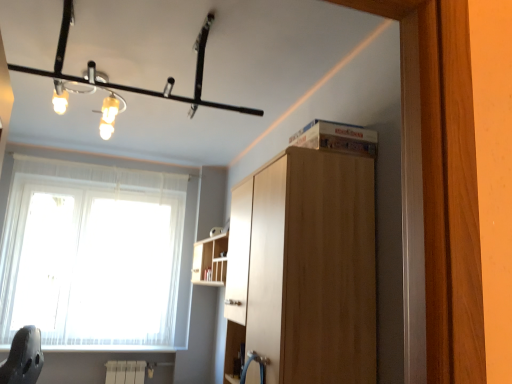
Question: Is matte black light fixture at upper center closer to camera compared to wooden shelf at upper center?

Choices:
 (A) yes
 (B) no

Answer: (A)

Question: Does matte black light fixture at upper center appear on the right side of wooden shelf at upper center?

Choices:
 (A) yes
 (B) no

Answer: (B)

Question: From a real-world perspective, is matte black light fixture at upper center on top of wooden shelf at upper center?

Choices:
 (A) yes
 (B) no

Answer: (A)

Question: From the image's perspective, is matte black light fixture at upper center above wooden shelf at upper center?

Choices:
 (A) no
 (B) yes

Answer: (B)

Question: Does matte black light fixture at upper center have a larger size compared to wooden shelf at upper center?

Choices:
 (A) yes
 (B) no

Answer: (B)

Question: Considering the positions of light brown wood cabinet at upper center and matte black light fixture at upper center in the image, is light brown wood cabinet at upper center bigger or smaller than matte black light fixture at upper center?

Choices:
 (A) small
 (B) big

Answer: (B)

Question: Relative to matte black light fixture at upper center, is light brown wood cabinet at upper center in front or behind?

Choices:
 (A) front
 (B) behind

Answer: (A)

Question: Would you say light brown wood cabinet at upper center is to the left or to the right of matte black light fixture at upper center in the picture?

Choices:
 (A) right
 (B) left

Answer: (A)

Question: Is light brown wood cabinet at upper center taller or shorter than matte black light fixture at upper center?

Choices:
 (A) short
 (B) tall

Answer: (B)

Question: Is wooden shelf at upper center in front of or behind white sheer curtain at left in the image?

Choices:
 (A) front
 (B) behind

Answer: (A)

Question: Is wooden shelf at upper center to the left or to the right of white sheer curtain at left in the image?

Choices:
 (A) left
 (B) right

Answer: (B)

Question: Is wooden shelf at upper center taller or shorter than white sheer curtain at left?

Choices:
 (A) short
 (B) tall

Answer: (A)

Question: From the image's perspective, is wooden shelf at upper center above or below white sheer curtain at left?

Choices:
 (A) below
 (B) above

Answer: (B)

Question: Relative to white sheer curtain at left, is matte black light fixture at upper center in front or behind?

Choices:
 (A) behind
 (B) front

Answer: (B)

Question: Is matte black light fixture at upper center spatially inside white sheer curtain at left, or outside of it?

Choices:
 (A) inside
 (B) outside

Answer: (B)